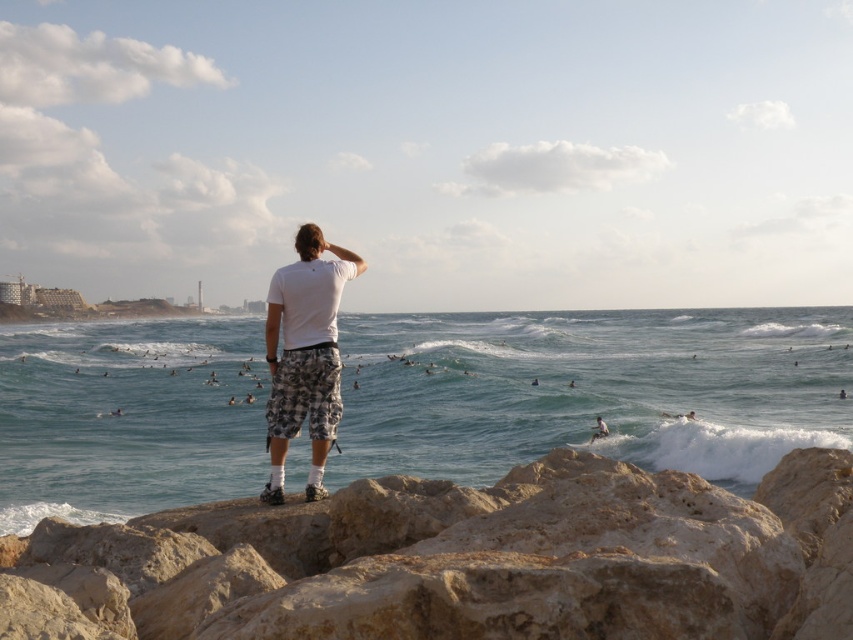
Question: Which object is farther from the camera taking this photo?

Choices:
 (A) beige rock at center
 (B) white cotton t-shirt at center
 (C) clear blue water at center

Answer: (C)

Question: Can you confirm if beige rock at center is positioned below white cotton t-shirt at center?

Choices:
 (A) no
 (B) yes

Answer: (B)

Question: Is clear blue water at center smaller than white cotton t-shirt at center?

Choices:
 (A) no
 (B) yes

Answer: (A)

Question: Which point is closer to the camera taking this photo?

Choices:
 (A) (514, 432)
 (B) (299, 557)

Answer: (B)

Question: Which point is farther to the camera?

Choices:
 (A) (308, 404)
 (B) (483, 516)

Answer: (A)

Question: Does clear blue water at center lie in front of beige rock at center?

Choices:
 (A) no
 (B) yes

Answer: (A)